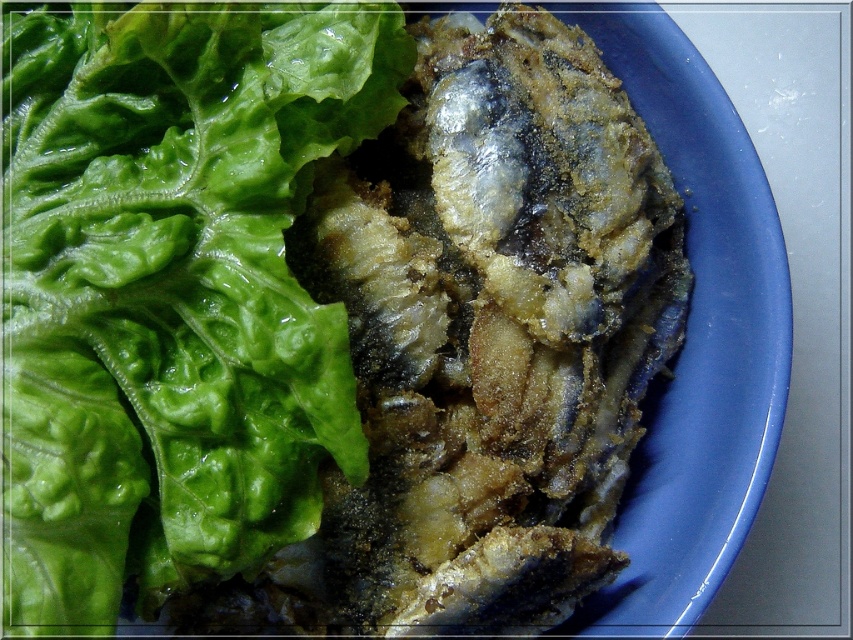
At what (x,y) coordinates should I click in order to perform the action: click on green leafy at upper left. Please return your answer as a coordinate pair (x, y). Looking at the image, I should click on (171, 289).

Is green leafy at upper left bigger than fried golden-brown fish at center?

Incorrect, green leafy at upper left is not larger than fried golden-brown fish at center.

Find the location of a particular element. green leafy at upper left is located at coordinates (171, 289).

Find the location of a particular element. green leafy at upper left is located at coordinates (171, 289).